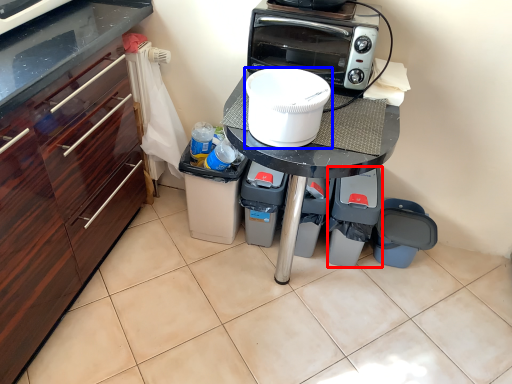
Question: Which of the following is the farthest to the observer, appliance (highlighted by a red box) or home appliance (highlighted by a blue box)?

Choices:
 (A) appliance
 (B) home appliance

Answer: (A)